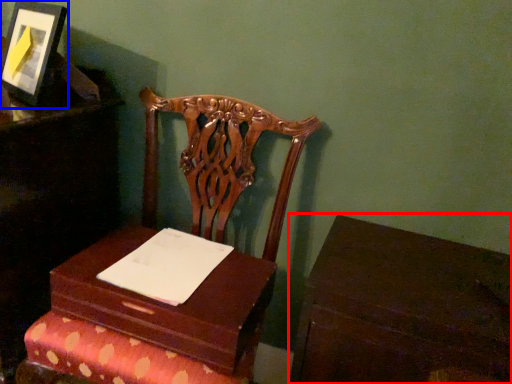
Question: Which point is closer to the camera, table (highlighted by a red box) or picture frame (highlighted by a blue box)?

Choices:
 (A) table
 (B) picture frame

Answer: (A)